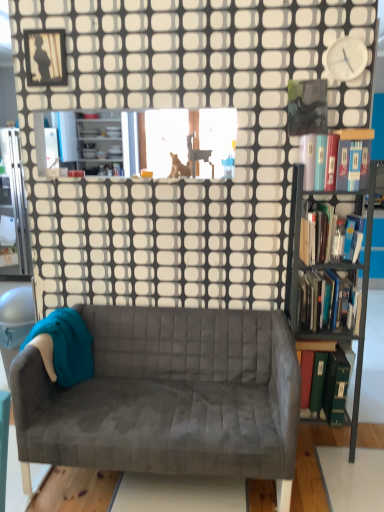
Question: In terms of width, does metallic black bookcase at right look wider or thinner when compared to brown furry dog at upper center?

Choices:
 (A) thin
 (B) wide

Answer: (B)

Question: In terms of height, does metallic black bookcase at right look taller or shorter compared to brown furry dog at upper center?

Choices:
 (A) short
 (B) tall

Answer: (B)

Question: Estimate the real-world distances between objects in this image. Which object is closer to the hardcover book at right, which is counted as the 1th book, starting from the top?

Choices:
 (A) matte black picture frame at upper left
 (B) white plastic clock at upper right
 (C) hardcover book at right, the 2th book when ordered from bottom to top
 (D) green hardcover book at right, which appears as the 4th book when viewed from the top
 (E) brown furry dog at upper center

Answer: (B)

Question: Which object is the farthest from the matte black picture frame at upper left?

Choices:
 (A) metallic black bookcase at right
 (B) white plastic clock at upper right
 (C) hardcover book at right, arranged as the third book when ordered from the bottom
 (D) velvet gray couch at center
 (E) brown furry dog at upper center

Answer: (D)